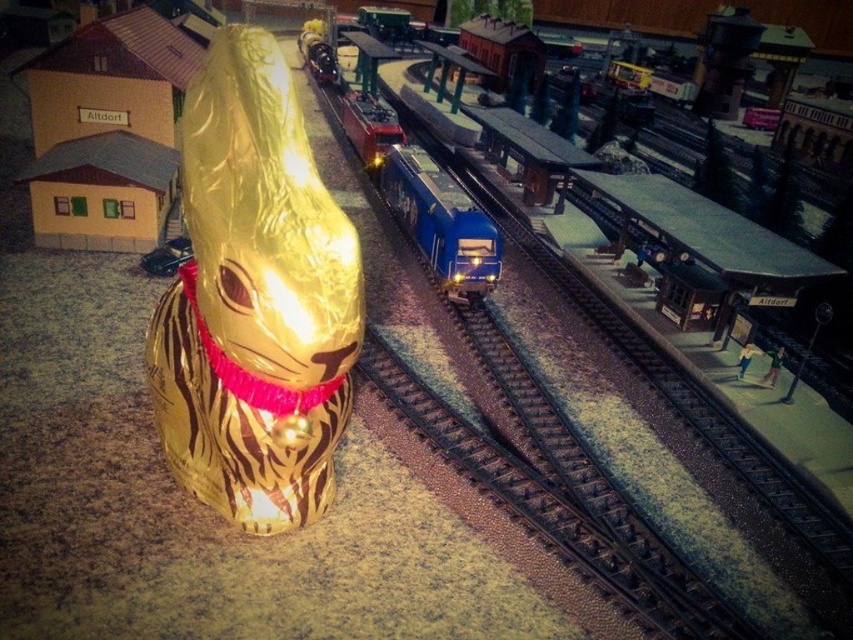
Question: Does gold foil bunny at left appear on the right side of blue metallic train at center?

Choices:
 (A) no
 (B) yes

Answer: (A)

Question: Is metallic blue train tracks at center below blue metallic train at center?

Choices:
 (A) yes
 (B) no

Answer: (A)

Question: Which point is farther to the camera?

Choices:
 (A) gold foil bunny at left
 (B) blue metallic train at center
 (C) metallic blue train tracks at center

Answer: (B)

Question: Which point is farther to the camera?

Choices:
 (A) gold foil bunny at left
 (B) metallic blue train tracks at center

Answer: (B)

Question: Can you confirm if gold foil bunny at left is positioned below blue metallic train at center?

Choices:
 (A) no
 (B) yes

Answer: (B)

Question: Which point is closer to the camera?

Choices:
 (A) (566, 276)
 (B) (384, 145)
 (C) (318, 339)

Answer: (C)